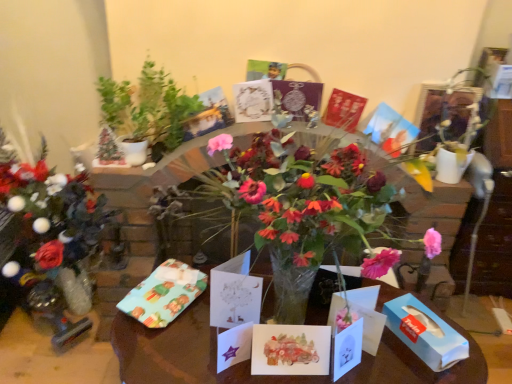
Where is `spots to the right of white paper card at center, positioned as the fifth birthday card in back-to-front order`? spots to the right of white paper card at center, positioned as the fifth birthday card in back-to-front order is located at coordinates (382, 364).